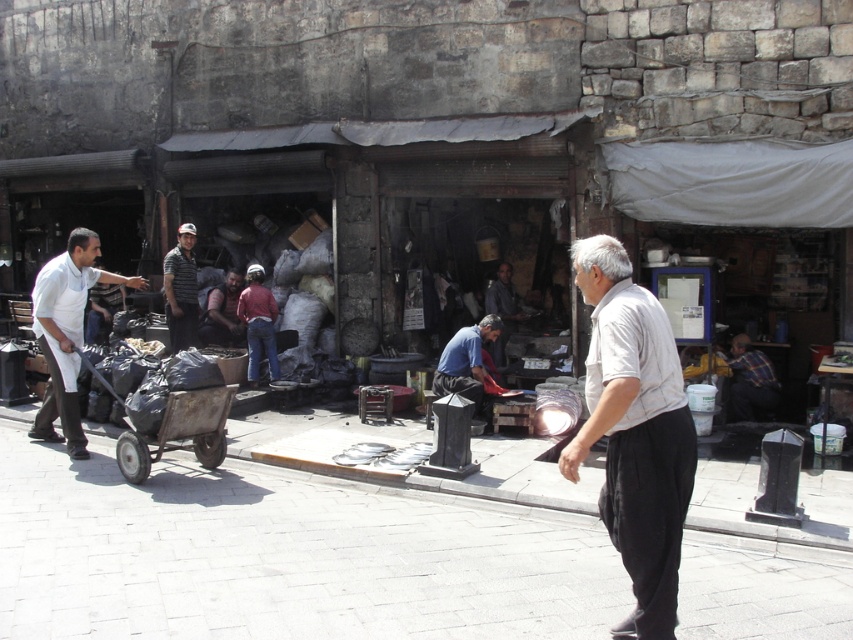
Question: Can you confirm if white cotton shirt at center is positioned to the right of rusty metal man at center?

Choices:
 (A) no
 (B) yes

Answer: (B)

Question: Based on their relative distances, which object is nearer to the rusty metal man at center?

Choices:
 (A) plaid shirt at right
 (B) dark gray fabric shirt at center
 (C) white apron at left

Answer: (C)

Question: Estimate the real-world distances between objects in this image. Which object is farther from the blue shirt at center?

Choices:
 (A) dark gray fabric shirt at center
 (B) red shirt at center

Answer: (B)

Question: Does white apron at left appear on the right side of striped shirt at center?

Choices:
 (A) yes
 (B) no

Answer: (B)

Question: Can you confirm if white cotton shirt at center is positioned to the right of rusty metal cart at center-left?

Choices:
 (A) yes
 (B) no

Answer: (A)

Question: Which of the following is the farthest from the observer?

Choices:
 (A) (573, 250)
 (B) (231, 385)
 (C) (76, 452)

Answer: (A)